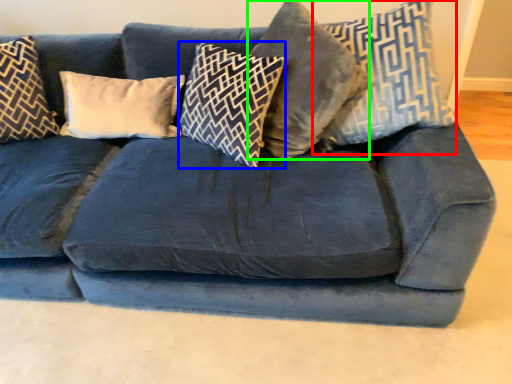
Question: Based on their relative distances, which object is farther from pillow (highlighted by a red box)? Choose from pillow (highlighted by a blue box) and pillow (highlighted by a green box).

Choices:
 (A) pillow
 (B) pillow

Answer: (A)